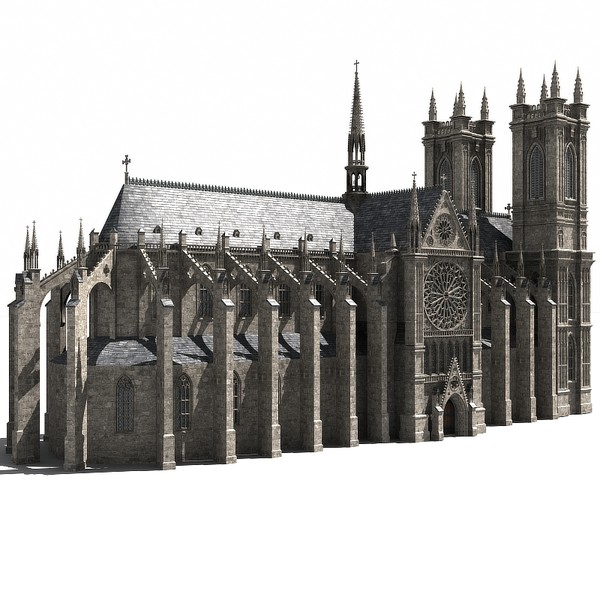
This screenshot has height=600, width=600. I want to click on bottom of pillar, so click(x=73, y=456), click(x=19, y=448), click(x=167, y=454), click(x=229, y=453), click(x=278, y=440), click(x=319, y=440), click(x=349, y=435), click(x=506, y=413), click(x=532, y=413), click(x=552, y=409).